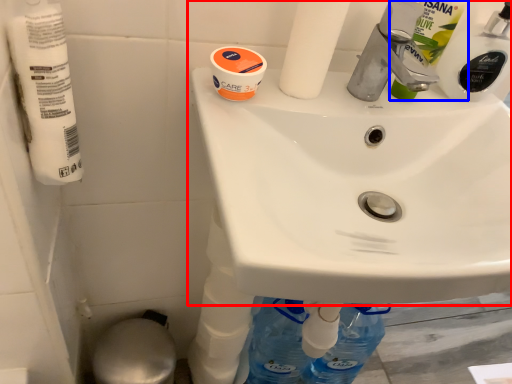
Question: Among these objects, which one is farthest to the camera, sink (highlighted by a red box) or cleaning product (highlighted by a blue box)?

Choices:
 (A) sink
 (B) cleaning product

Answer: (B)